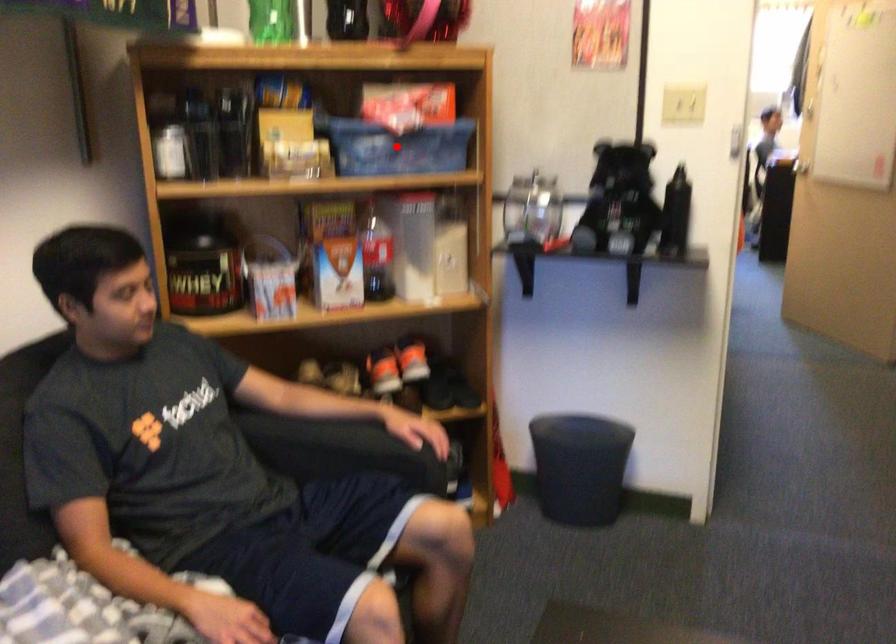
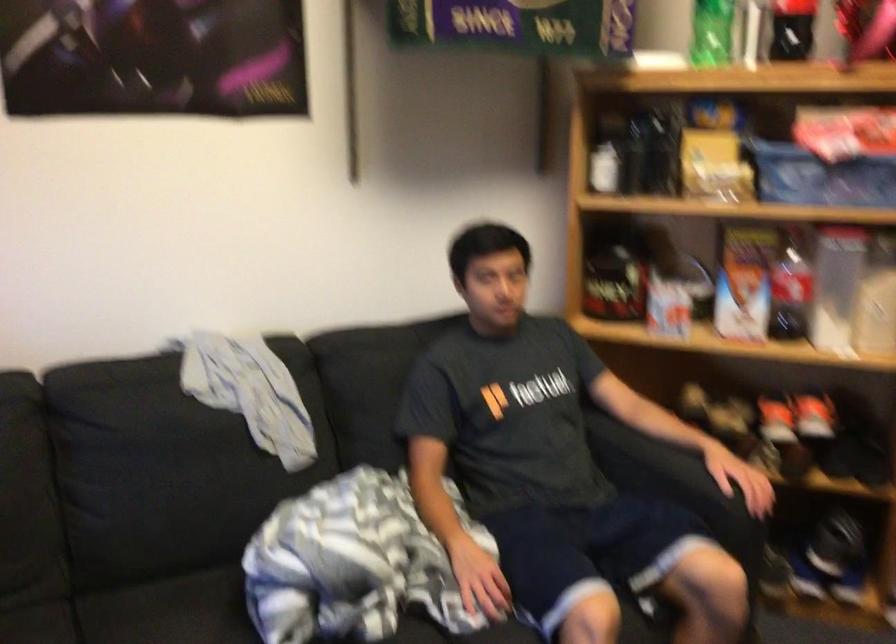
The point at the highlighted location is marked in the first image. Where is the corresponding point in the second image?

(820, 176)